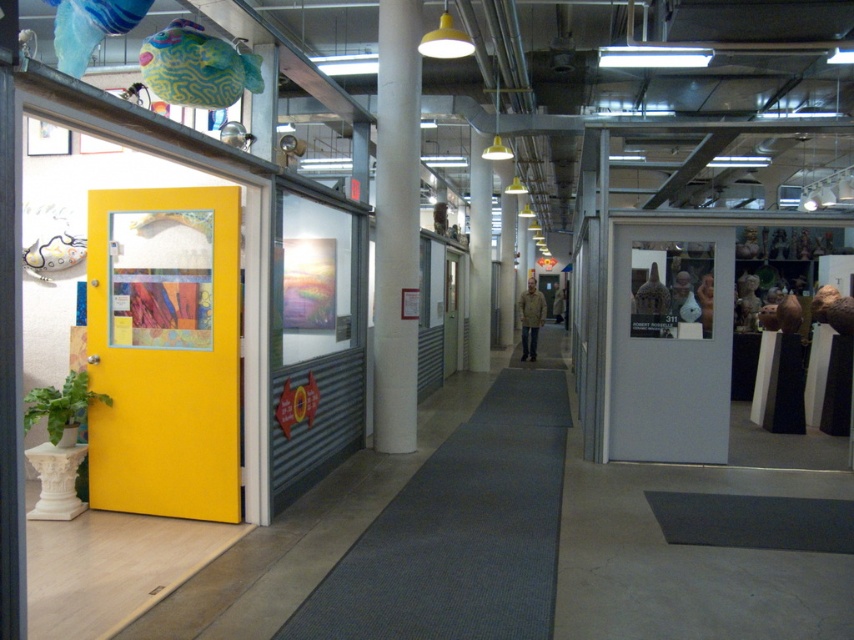
You are a delivery person carrying a large box that is 1.2 meters wide. You need to navigate through the hallway and pass between the white smooth pillar at center and the tan textured jacket at center. Can your box fit through the space between them?

The white smooth pillar at center might be wider than tan textured jacket at center, so the space between them could be narrower than 1.2 meters. Therefore, the box might not fit through the space between the white smooth pillar at center and the tan textured jacket at center.

From the picture: You are navigating through the hallway and need to reach the bright yellow door with a glass panel at the top. Which direction should you move relative to the white smooth pillar at center?

To reach the bright yellow door with a glass panel at the top, you should move to the left of the white smooth pillar at center since the door is on the left side of the hallway.

You are a delivery person carrying a 10 meter long pipe that is too large to disassemble. You need to move it through the hallway shown in the image. The pipe must be carried horizontally. Can you fit the pipe between the white smooth pillar at center and the tan textured jacket at center?

The white smooth pillar at center and tan textured jacket at center are 9.64 meters apart from each other. Since the pipe is 10 meters long, it is slightly longer than the distance between them, so the pipe cannot fit between them horizontally.